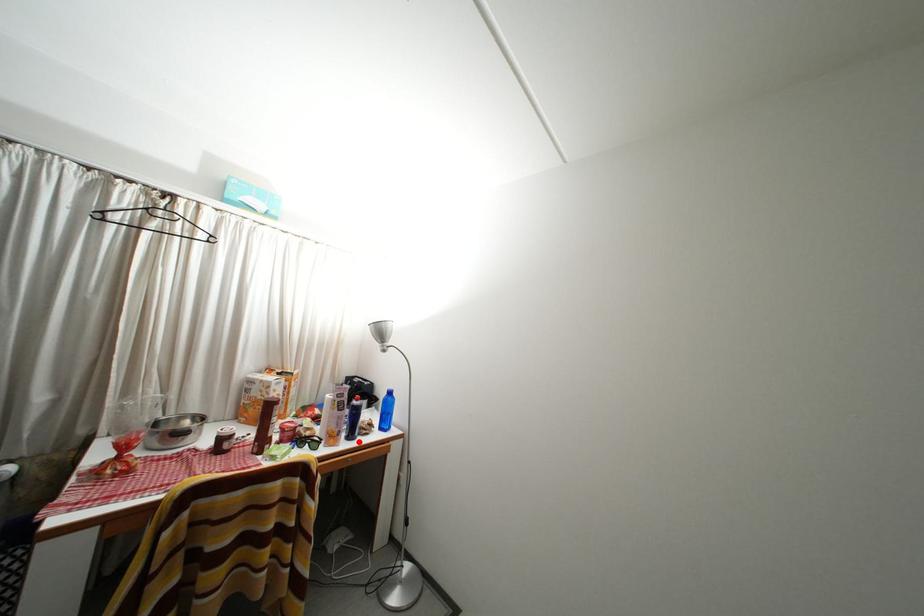
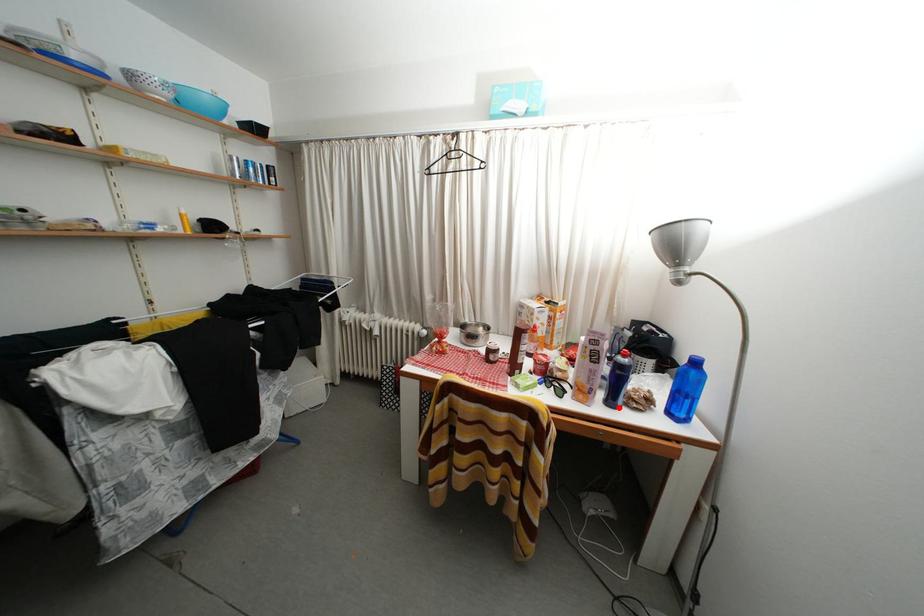
I am providing you with two images of the same scene from different viewpoints. A red point is marked on the first image and another point is marked on the second image. Does the point marked in image1 correspond to the same location as the one in image2?

Yes